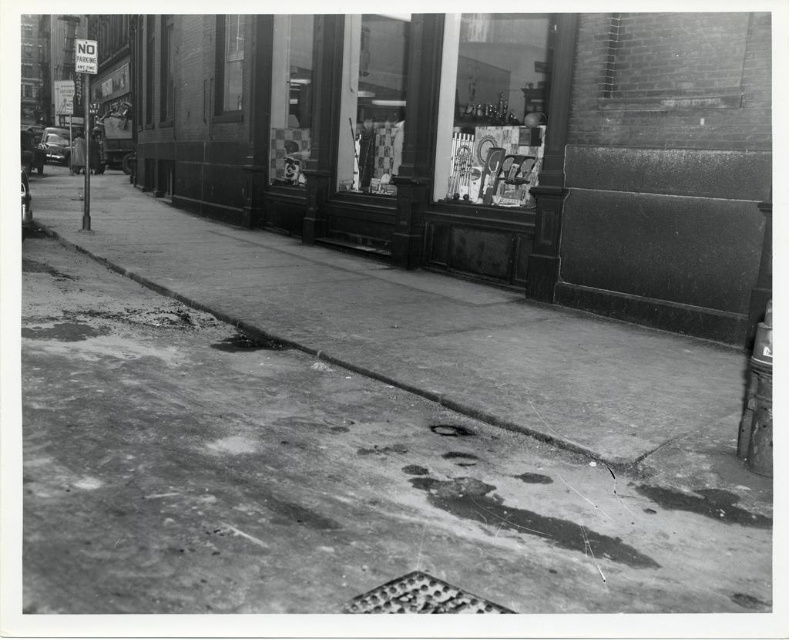
Can you confirm if glass display case at upper center is positioned to the left of metallic grid manhole cover at lower center?

No, glass display case at upper center is not to the left of metallic grid manhole cover at lower center.

Does glass display case at upper center lie behind metallic grid manhole cover at lower center?

Yes, glass display case at upper center is further from the viewer.

Who is more distant from viewer, (462, 134) or (365, 598)?

Positioned behind is point (462, 134).

The width and height of the screenshot is (789, 640). I want to click on glass display case at upper center, so click(496, 106).

Is point (548, 536) farther from camera compared to point (509, 35)?

No, (548, 536) is closer to viewer.

Is concrete sidewalk at center wider than glass display case at upper center?

Correct, the width of concrete sidewalk at center exceeds that of glass display case at upper center.

Describe the element at coordinates (354, 435) in the screenshot. I see `concrete sidewalk at center` at that location.

This screenshot has width=789, height=640. Find the location of `concrete sidewalk at center`. concrete sidewalk at center is located at coordinates (354, 435).

Is glass display case at upper center wider than metallic gray manhole cover at center?

Correct, the width of glass display case at upper center exceeds that of metallic gray manhole cover at center.

What do you see at coordinates (496, 106) in the screenshot? I see `glass display case at upper center` at bounding box center [496, 106].

In order to click on glass display case at upper center in this screenshot , I will do `click(496, 106)`.